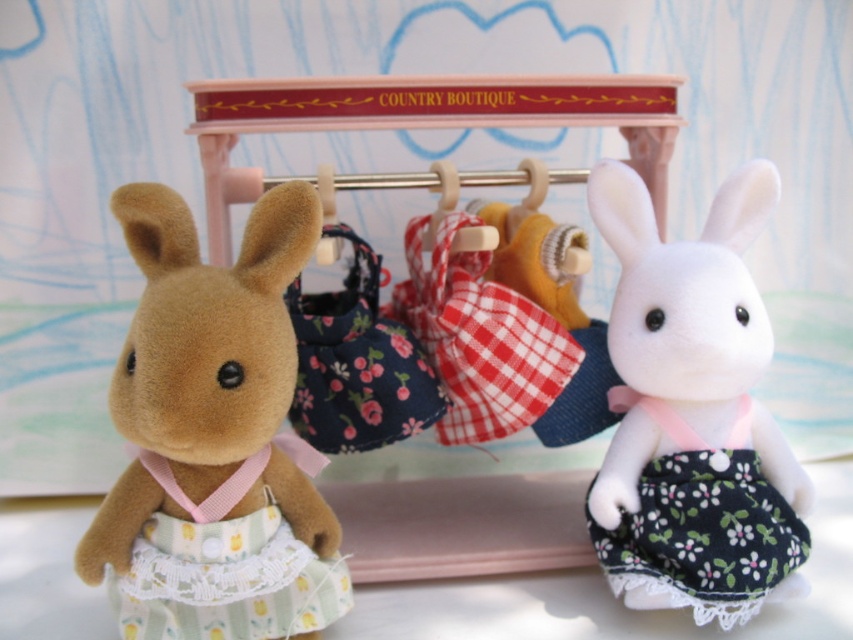
You are a customer at the COUNTRY BOUTIQUE and want to buy the white fabric dress at right. Where exactly is it positioned relative to the display rack?

The white fabric dress at right is located at point (x=693, y=413) on the display rack.

You are a customer in a store looking at the Country Boutique display. You see the fluffy brown plush at left and the black floral fabric dress at center. Which item is bigger?

The fluffy brown plush at left is larger in size compared to the black floral fabric dress at center.